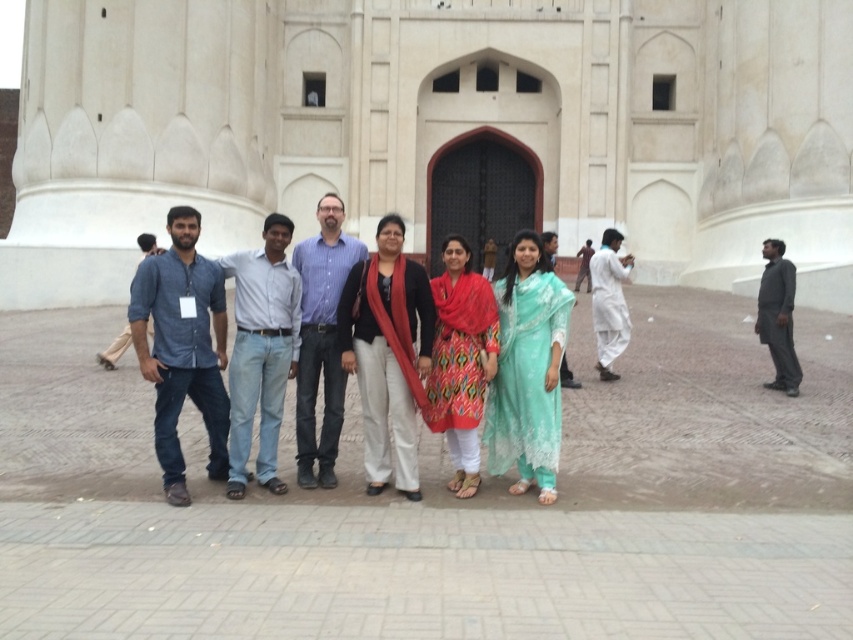
Question: Observing the image, what is the correct spatial positioning of teal silk salwar kameez at center in reference to white cotton kurta at center?

Choices:
 (A) above
 (B) below

Answer: (B)

Question: From the image, what is the correct spatial relationship of matte black jacket at center in relation to teal silk salwar kameez at center?

Choices:
 (A) right
 (B) left

Answer: (B)

Question: Which is nearer to the printed cotton dress at center?

Choices:
 (A) matte black jacket at center
 (B) white cotton kurta at center

Answer: (A)

Question: Based on their relative distances, which object is farther from the teal silk salwar kameez at center?

Choices:
 (A) dark gray fabric at right
 (B) white cotton kurta at center
 (C) printed cotton dress at center
 (D) matte black jacket at center

Answer: (B)

Question: Does teal silk salwar kameez at center come in front of dark gray fabric at right?

Choices:
 (A) no
 (B) yes

Answer: (B)

Question: Which point is farther from the camera taking this photo?

Choices:
 (A) (430, 285)
 (B) (543, 472)
 (C) (786, 348)
 (D) (341, 291)

Answer: (C)